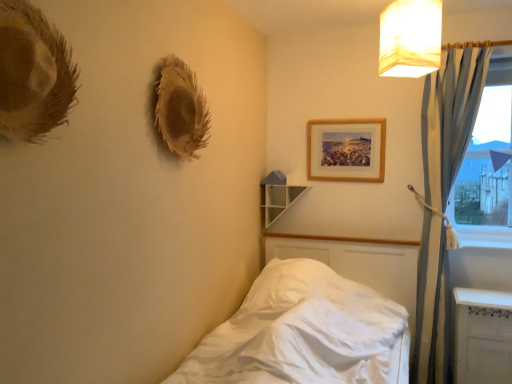
Describe the element at coordinates (483, 336) in the screenshot. I see `white glossy radiator at lower right` at that location.

What are the coordinates of `white glossy window sill at lower right` in the screenshot? It's located at (486, 244).

Locate an element on the screen. white fabric lampshade at upper right is located at coordinates (410, 38).

This screenshot has height=384, width=512. Identify the location of white satin bed at lower left. (304, 333).

Describe the element at coordinates (304, 333) in the screenshot. The width and height of the screenshot is (512, 384). I see `white satin bed at lower left` at that location.

Find the location of a particular element. This screenshot has width=512, height=384. white glossy radiator at lower right is located at coordinates (483, 336).

In the image, is white glossy shelf at upper center positioned in front of or behind white glossy radiator at lower right?

Clearly, white glossy shelf at upper center is behind white glossy radiator at lower right.

Considering the relative sizes of white glossy shelf at upper center and white glossy radiator at lower right in the image provided, is white glossy shelf at upper center wider than white glossy radiator at lower right?

No, white glossy shelf at upper center is not wider than white glossy radiator at lower right.

Considering the positions of objects white glossy shelf at upper center and white glossy radiator at lower right in the image provided, who is more to the left, white glossy shelf at upper center or white glossy radiator at lower right?

Positioned to the left is white glossy shelf at upper center.

Between point (279, 193) and point (455, 382), which one is positioned in front?

The point (455, 382) is closer.

Which is correct: white glossy shelf at upper center is inside white satin bed at lower left, or outside of it?

The correct answer is: outside.

How much distance is there between white glossy shelf at upper center and white satin bed at lower left?

white glossy shelf at upper center and white satin bed at lower left are 37.99 inches apart.

Which point is more distant from viewer, [284,178] or [291,340]?

The point [284,178] is more distant.

From a real-world perspective, is white glossy shelf at upper center positioned above or below white satin bed at lower left?

Clearly, from a real-world perspective, white glossy shelf at upper center is above white satin bed at lower left.

Which is in front, wooden picture frame at upper center or blue fabric curtain at right?

Positioned in front is blue fabric curtain at right.

Based on the photo, is wooden picture frame at upper center facing towards blue fabric curtain at right?

No.

Does wooden picture frame at upper center contain blue fabric curtain at right?

No, blue fabric curtain at right is not a part of wooden picture frame at upper center.

I want to click on picture frame on the left side of blue fabric curtain at right, so click(347, 150).

Is white fabric lampshade at upper right at the back of transparent glass window at right?

No, transparent glass window at right's orientation is not away from white fabric lampshade at upper right.

From a real-world perspective, between transparent glass window at right and white fabric lampshade at upper right, who is vertically lower?

In real-world perspective, transparent glass window at right is lower.

Would you say transparent glass window at right is a long distance from white fabric lampshade at upper right?

transparent glass window at right is near white fabric lampshade at upper right, not far away.

Can you confirm if white fabric lampshade at upper right is positioned to the right of white glossy radiator at lower right?

In fact, white fabric lampshade at upper right is to the left of white glossy radiator at lower right.

How different are the orientations of white fabric lampshade at upper right and white glossy radiator at lower right in degrees?

There is a 26.1-degree angle between the facing directions of white fabric lampshade at upper right and white glossy radiator at lower right.

Would you say white fabric lampshade at upper right is outside white glossy radiator at lower right?

white fabric lampshade at upper right is positioned outside white glossy radiator at lower right.

Do you think white satin bed at lower left is within wooden picture frame at upper center, or outside of it?

white satin bed at lower left is spatially situated outside wooden picture frame at upper center.

In the image, is white satin bed at lower left positioned in front of or behind wooden picture frame at upper center?

In the image, white satin bed at lower left appears in front of wooden picture frame at upper center.

Which of these two, white satin bed at lower left or wooden picture frame at upper center, stands taller?

white satin bed at lower left is taller.

Is white fabric lampshade at upper right far from white glossy window sill at lower right?

Yes, white fabric lampshade at upper right and white glossy window sill at lower right are quite far apart.

Which is behind, point (413, 33) or point (510, 242)?

The point (510, 242) is farther.

From a real-world perspective, is white fabric lampshade at upper right on top of white glossy window sill at lower right?

Yes, from a real-world perspective, white fabric lampshade at upper right is on top of white glossy window sill at lower right.

Choose the correct answer: Is white fabric lampshade at upper right inside white glossy window sill at lower right or outside it?

white fabric lampshade at upper right is not enclosed by white glossy window sill at lower right.

Locate an element on the screen. The image size is (512, 384). radiator in front of the white glossy shelf at upper center is located at coordinates coord(483,336).

This screenshot has height=384, width=512. I want to click on shelf above the white satin bed at lower left (from a real-world perspective), so click(x=277, y=196).

Looking at the image, which one is located further to white satin bed at lower left, white glossy window sill at lower right or blue fabric curtain at right?

white glossy window sill at lower right lies further to white satin bed at lower left than the other object.

Estimate the real-world distances between objects in this image. Which object is further from white glossy radiator at lower right, white satin bed at lower left or wooden picture frame at upper center?

Based on the image, wooden picture frame at upper center appears to be further to white glossy radiator at lower right.

Based on their spatial positions, is white glossy radiator at lower right or blue fabric curtain at right closer to white glossy shelf at upper center?

blue fabric curtain at right is positioned closer to the anchor white glossy shelf at upper center.

Looking at the image, which one is located closer to white glossy radiator at lower right, white fabric lampshade at upper right or blue fabric curtain at right?

blue fabric curtain at right is closer to white glossy radiator at lower right.

Estimate the real-world distances between objects in this image. Which object is further from white glossy shelf at upper center, blue fabric curtain at right or white glossy radiator at lower right?

white glossy radiator at lower right is positioned further to the anchor white glossy shelf at upper center.

Considering their positions, is white fabric lampshade at upper right positioned closer to blue fabric curtain at right than white glossy window sill at lower right?

white glossy window sill at lower right.

Considering their positions, is white glossy window sill at lower right positioned further to white glossy shelf at upper center than white satin bed at lower left?

white glossy window sill at lower right.

Based on their spatial positions, is white glossy shelf at upper center or white fabric lampshade at upper right further from white satin bed at lower left?

The object further to white satin bed at lower left is white fabric lampshade at upper right.

Identify the location of lamp between white satin bed at lower left and white glossy window sill at lower right along the z-axis. The height and width of the screenshot is (384, 512). (410, 38).

Identify the location of curtain between white glossy shelf at upper center and white glossy radiator at lower right in the horizontal direction. (442, 202).

In order to click on picture frame between white glossy shelf at upper center and transparent glass window at right in the horizontal direction in this screenshot , I will do `click(347, 150)`.

Identify the location of radiator between white glossy shelf at upper center and transparent glass window at right from left to right. This screenshot has height=384, width=512. (483, 336).